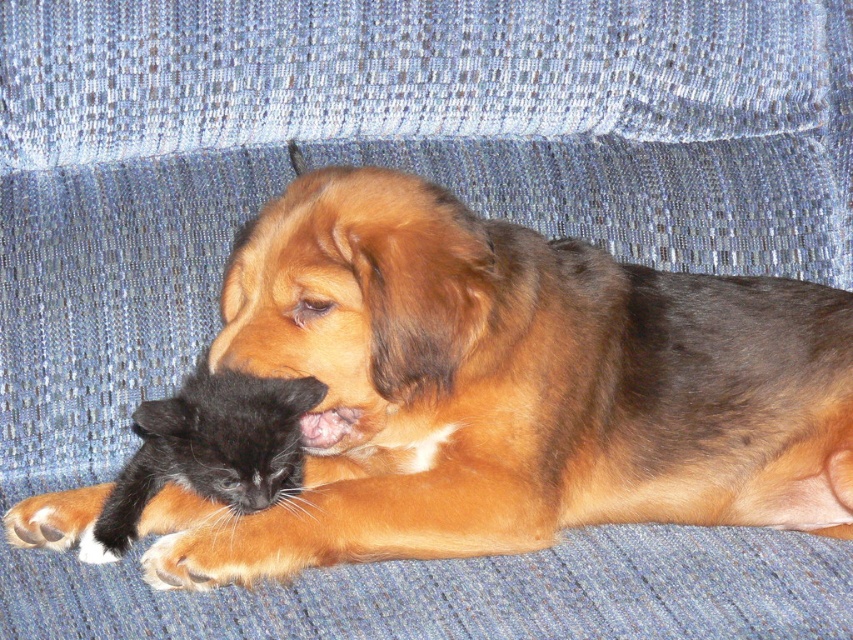
Can you confirm if brown fur dog at center is positioned above black fur/kitten at lower left?

Correct, brown fur dog at center is located above black fur/kitten at lower left.

Can you confirm if brown fur dog at center is bigger than black fur/kitten at lower left?

Indeed, brown fur dog at center has a larger size compared to black fur/kitten at lower left.

Who is more distant from viewer, [809,289] or [270,448]?

Point [809,289]

Find the location of `brown fur dog at center`. brown fur dog at center is located at coordinates (508, 388).